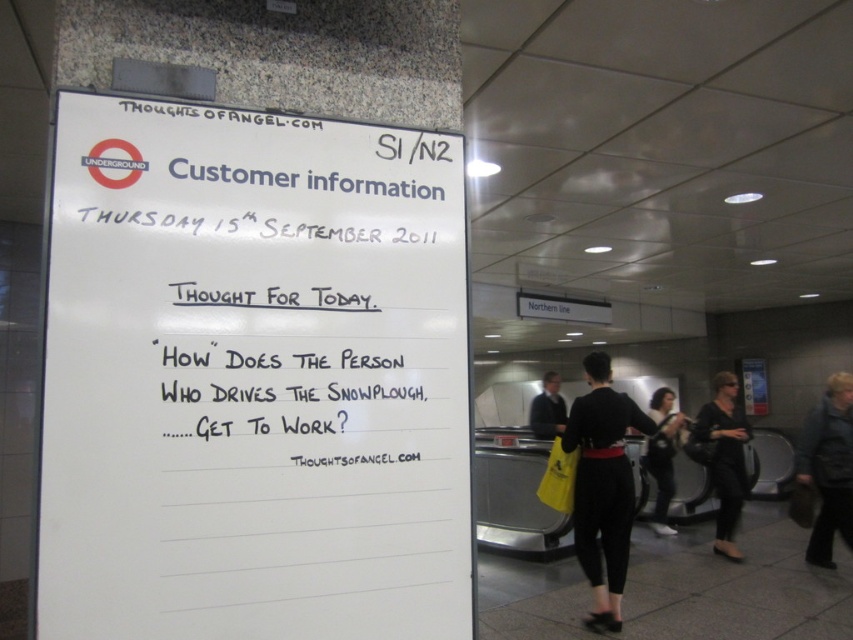
Describe the element at coordinates (828, 467) in the screenshot. I see `black leather jacket at lower right` at that location.

Measure the distance between black leather jacket at lower right and camera.

A distance of 17.06 feet exists between black leather jacket at lower right and camera.

In order to click on black leather jacket at lower right in this screenshot , I will do `click(828, 467)`.

Is point (624, 404) positioned after point (730, 480)?

That is False.

Who is more forward, (606,404) or (724,547)?

Point (606,404)

The width and height of the screenshot is (853, 640). I want to click on black fabric pants at lower center, so click(602, 486).

Does white paperboard at upper left have a lesser width compared to dark gray suit at center?

Yes.

Does white paperboard at upper left have a greater height compared to dark gray suit at center?

No, white paperboard at upper left is not taller than dark gray suit at center.

At what (x,y) coordinates should I click in order to perform the action: click on white paperboard at upper left. Please return your answer as a coordinate pair (x, y). Image resolution: width=853 pixels, height=640 pixels. Looking at the image, I should click on (252, 378).